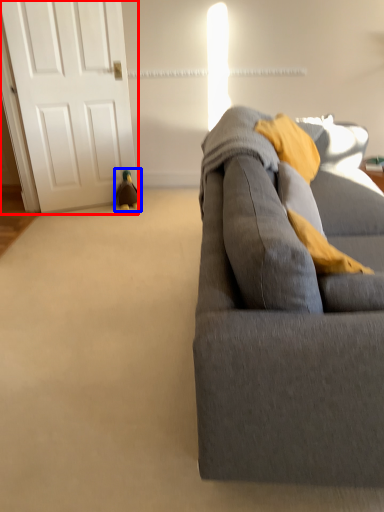
Question: Which object appears farthest to the camera in this image, door (highlighted by a red box) or toy (highlighted by a blue box)?

Choices:
 (A) door
 (B) toy

Answer: (B)